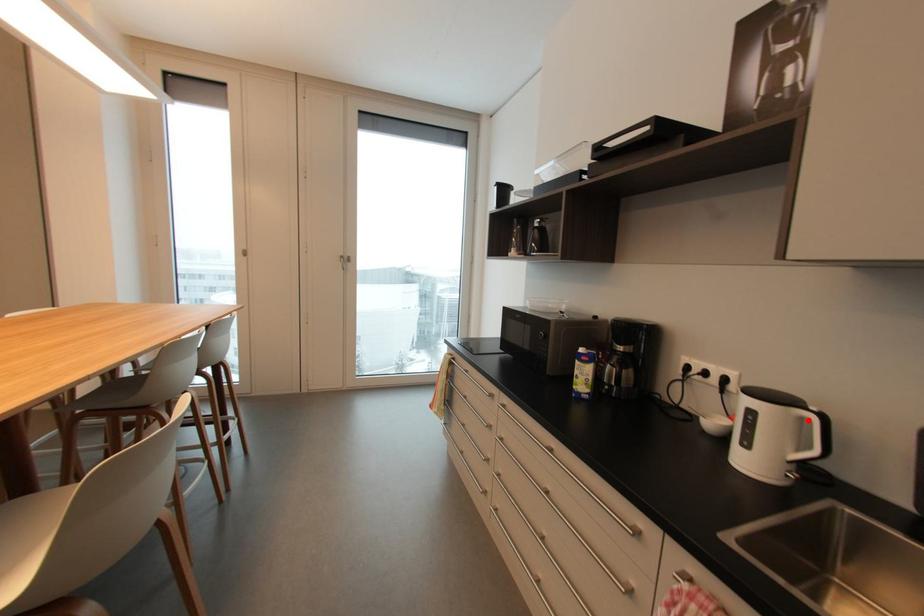
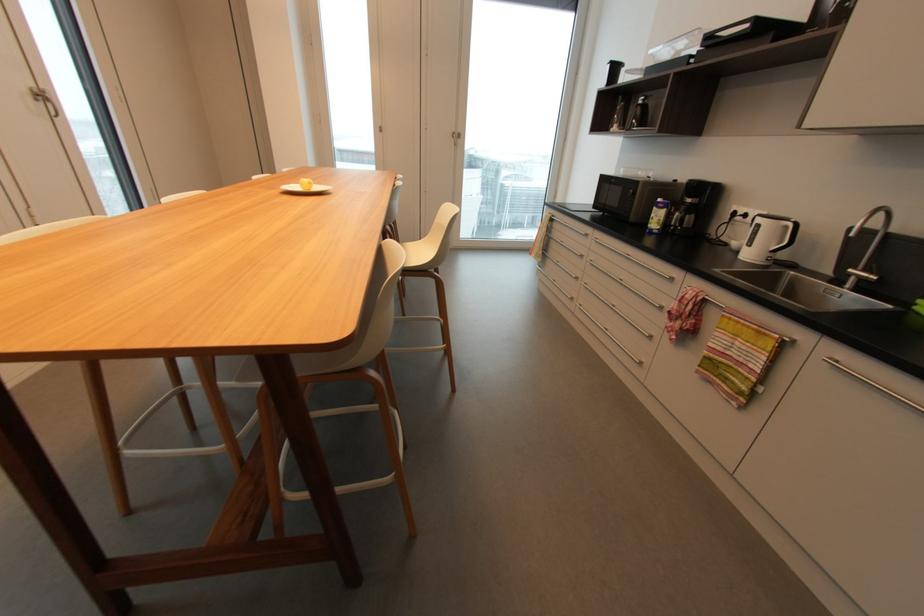
In the second image, find the point that corresponds to the highlighted location in the first image.

(789, 227)